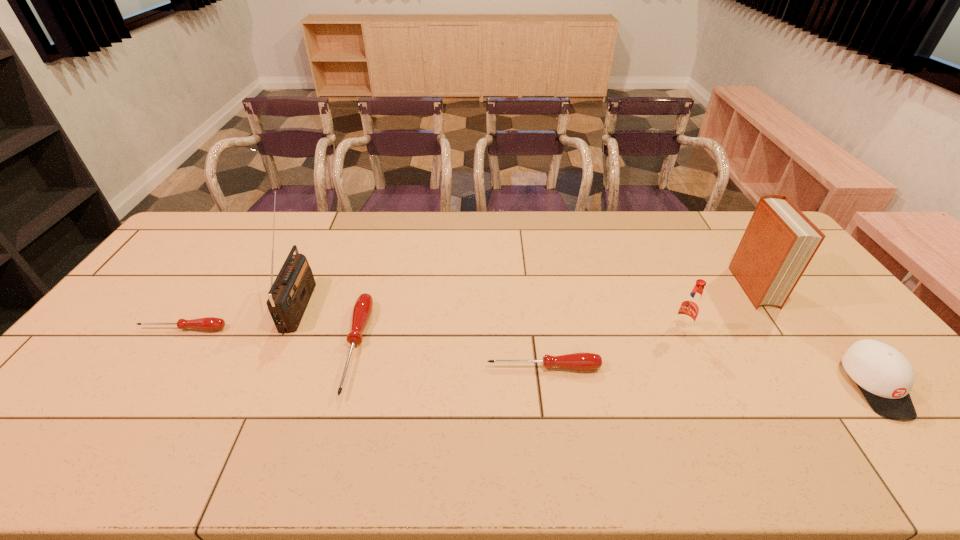
Identify the location of the leftmost screwdriver. The image size is (960, 540). (209, 323).

Where is `the shortest object`? This screenshot has height=540, width=960. the shortest object is located at coordinates (209, 323).

Find the location of `the second screwdriver from left to right`. the second screwdriver from left to right is located at coordinates (362, 309).

Locate an element on the screen. This screenshot has height=540, width=960. the sixth tallest object is located at coordinates (579, 361).

Identify the location of the rightmost screwdriver. This screenshot has width=960, height=540. (579, 361).

At what (x,y) coordinates should I click in order to perform the action: click on the sixth object from left to right. Please return your answer as a coordinate pair (x, y). The height and width of the screenshot is (540, 960). Looking at the image, I should click on (779, 242).

Identify the location of hardback book. (779, 242).

Find the location of a particular element. Image resolution: width=960 pixels, height=540 pixels. radio receiver is located at coordinates (290, 293).

You are a GUI agent. You are given a task and a screenshot of the screen. Output one action in this format:
    pyautogui.click(x=<x>, y=<y>)
    Task: Click on the baseball cap
    
    Given the screenshot: What is the action you would take?
    pyautogui.click(x=885, y=377)

What are the coordinates of `the fourth shortest object` in the screenshot? It's located at (885, 377).